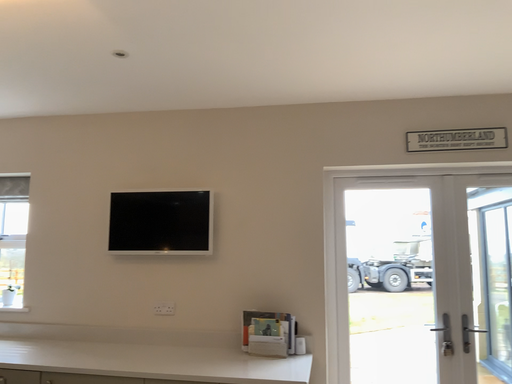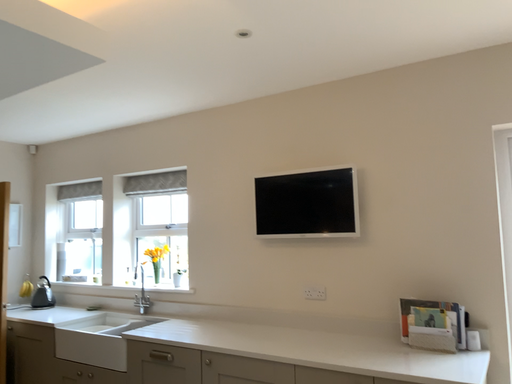
Question: Which way did the camera rotate in the video?

Choices:
 (A) rotated right
 (B) rotated left

Answer: (B)